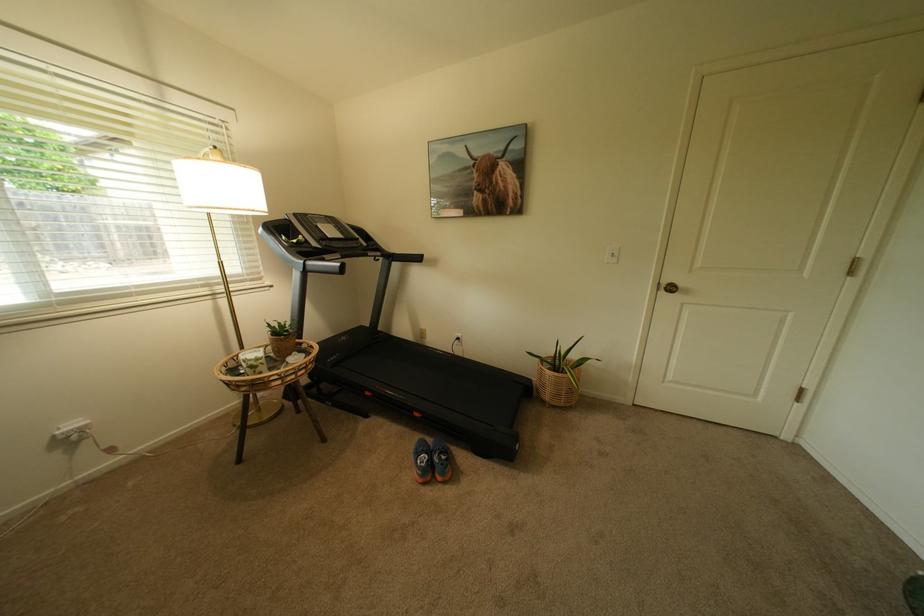
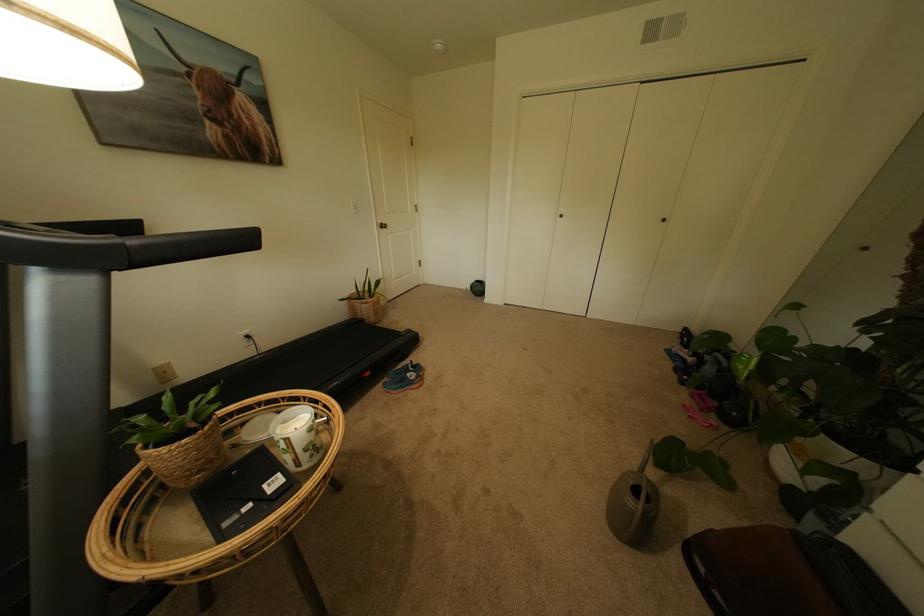
The point at (557, 391) is marked in the first image. Where is the corresponding point in the second image?

(382, 314)